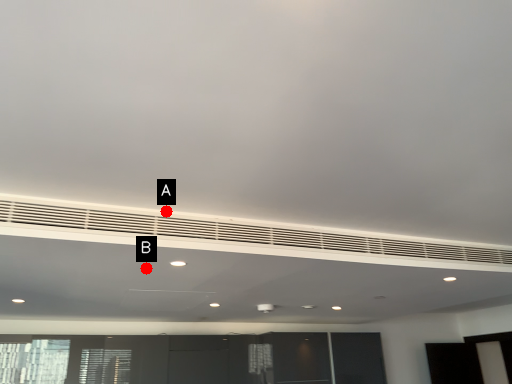
Question: Two points are circled on the image, labeled by A and B beside each circle. Which point is closer to the camera?

Choices:
 (A) A is closer
 (B) B is closer

Answer: (A)